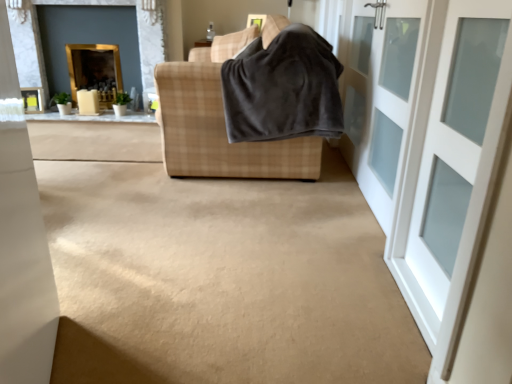
The image size is (512, 384). Describe the element at coordinates (95, 70) in the screenshot. I see `gold-framed mirror at upper left, the 2th fireplace when ordered from right to left` at that location.

Measure the distance between gold-framed mirror at upper left, the 2th fireplace when ordered from right to left, and camera.

gold-framed mirror at upper left, the 2th fireplace when ordered from right to left, is 4.09 meters away from camera.

In order to click on white glass door at right, acting as the second door starting from the back in this screenshot , I will do `click(460, 194)`.

What do you see at coordinates (136, 29) in the screenshot? The height and width of the screenshot is (384, 512). I see `gold-framed mirror at upper left, which is the first fireplace in right-to-left order` at bounding box center [136, 29].

Locate an element on the screen. Image resolution: width=512 pixels, height=384 pixels. gold-framed mirror at upper left, the 1th fireplace viewed from the left is located at coordinates (95, 70).

Which of these two, dark gray fleece blanket at center or plaid fabric sofa at center, is thinner?

Thinner between the two is dark gray fleece blanket at center.

Where is `furniture behind the dark gray fleece blanket at center`? furniture behind the dark gray fleece blanket at center is located at coordinates click(220, 124).

Considering the sizes of objects dark gray fleece blanket at center and plaid fabric sofa at center in the image provided, who is shorter, dark gray fleece blanket at center or plaid fabric sofa at center?

dark gray fleece blanket at center.

Based on the photo, considering the sizes of objects dark gray fleece blanket at center and plaid fabric sofa at center in the image provided, who is bigger, dark gray fleece blanket at center or plaid fabric sofa at center?

With larger size is plaid fabric sofa at center.

Which is more to the left, plaid fabric sofa at center or white glass door at right, arranged as the 1th door when viewed from the front?

plaid fabric sofa at center is more to the left.

How different are the orientations of plaid fabric sofa at center and white glass door at right, arranged as the 1th door when viewed from the front, in degrees?

0.00281 degrees separate the facing orientations of plaid fabric sofa at center and white glass door at right, arranged as the 1th door when viewed from the front.

Does point (213, 133) come behind point (437, 0)?

Yes, point (213, 133) is farther from viewer.

Could you tell me if plaid fabric sofa at center is turned towards white glass door at right, arranged as the 1th door when viewed from the front?

No, plaid fabric sofa at center is not turned towards white glass door at right, arranged as the 1th door when viewed from the front.

Looking at this image, is plaid fabric sofa at center positioned in front of gold-framed mirror at upper left, which is the first fireplace in right-to-left order?

Yes, it is.

In the scene shown: Does plaid fabric sofa at center appear on the right side of gold-framed mirror at upper left, arranged as the 2th fireplace when viewed from the left?

Yes, plaid fabric sofa at center is to the right of gold-framed mirror at upper left, arranged as the 2th fireplace when viewed from the left.

Considering the sizes of objects plaid fabric sofa at center and gold-framed mirror at upper left, arranged as the 2th fireplace when viewed from the left, in the image provided, who is wider, plaid fabric sofa at center or gold-framed mirror at upper left, arranged as the 2th fireplace when viewed from the left,?

plaid fabric sofa at center is wider.

Does plaid fabric sofa at center touch gold-framed mirror at upper left, which is the first fireplace in right-to-left order?

No, plaid fabric sofa at center is not next to gold-framed mirror at upper left, which is the first fireplace in right-to-left order.

Which of these two, dark gray fleece blanket at center or white glass door at right, which appears as the second door when viewed from the front, stands shorter?

dark gray fleece blanket at center.

Between dark gray fleece blanket at center and white glass door at right, marked as the 1th door in a back-to-front arrangement, which one has larger size?

With larger size is dark gray fleece blanket at center.

From the picture: Could you tell me if dark gray fleece blanket at center is turned towards white glass door at right, marked as the 1th door in a back-to-front arrangement?

No, dark gray fleece blanket at center is not turned towards white glass door at right, marked as the 1th door in a back-to-front arrangement.

Based on the photo, is dark gray fleece blanket at center at the left side of white glass door at right, which appears as the second door when viewed from the front?

Yes, dark gray fleece blanket at center is to the left of white glass door at right, which appears as the second door when viewed from the front.

From a real-world perspective, is white glass door at right, which appears as the second door when viewed from the front, over gold-framed mirror at upper left, the 1th fireplace viewed from the left?

Correct, in the physical world, white glass door at right, which appears as the second door when viewed from the front, is higher than gold-framed mirror at upper left, the 1th fireplace viewed from the left.

Does point (361, 40) lie behind point (111, 63)?

That is False.

How many degrees apart are the facing directions of white glass door at right, which appears as the second door when viewed from the front, and gold-framed mirror at upper left, the 2th fireplace when ordered from right to left?

There is a 90.2-degree angle between the facing directions of white glass door at right, which appears as the second door when viewed from the front, and gold-framed mirror at upper left, the 2th fireplace when ordered from right to left.

Could you tell me if gold-framed mirror at upper left, arranged as the 2th fireplace when viewed from the left, is facing plaid fabric sofa at center?

No, gold-framed mirror at upper left, arranged as the 2th fireplace when viewed from the left, is not facing towards plaid fabric sofa at center.

Based on the photo, considering the sizes of objects gold-framed mirror at upper left, which is the first fireplace in right-to-left order, and plaid fabric sofa at center in the image provided, who is taller, gold-framed mirror at upper left, which is the first fireplace in right-to-left order, or plaid fabric sofa at center?

gold-framed mirror at upper left, which is the first fireplace in right-to-left order.

From the image's perspective, which is above, gold-framed mirror at upper left, arranged as the 2th fireplace when viewed from the left, or plaid fabric sofa at center?

From the image's view, gold-framed mirror at upper left, arranged as the 2th fireplace when viewed from the left, is above.

Do you think gold-framed mirror at upper left, which is the first fireplace in right-to-left order, is within plaid fabric sofa at center, or outside of it?

The correct answer is: outside.

From the image's perspective, which one is positioned lower, dark gray fleece blanket at center or gold-framed mirror at upper left, arranged as the 2th fireplace when viewed from the left?

From the image's view, dark gray fleece blanket at center is below.

The height and width of the screenshot is (384, 512). I want to click on blanket located above the gold-framed mirror at upper left, which is the first fireplace in right-to-left order (from a real-world perspective), so [x=283, y=88].

From a real-world perspective, which is physically below, dark gray fleece blanket at center or gold-framed mirror at upper left, which is the first fireplace in right-to-left order?

In real-world perspective, gold-framed mirror at upper left, which is the first fireplace in right-to-left order, is lower.

How far apart are dark gray fleece blanket at center and gold-framed mirror at upper left, which is the first fireplace in right-to-left order?

2.09 meters.

Locate an element on the screen. blanket to the right of plaid fabric sofa at center is located at coordinates (283, 88).

This screenshot has width=512, height=384. Find the location of `furniture above the white glass door at right, acting as the second door starting from the back (from a real-world perspective)`. furniture above the white glass door at right, acting as the second door starting from the back (from a real-world perspective) is located at coordinates [x=220, y=124].

Looking at the image, which one is located closer to white glass door at right, arranged as the 1th door when viewed from the front, gold-framed mirror at upper left, the 1th fireplace viewed from the left, or white glass door at right, which appears as the second door when viewed from the front?

Based on the image, white glass door at right, which appears as the second door when viewed from the front, appears to be nearer to white glass door at right, arranged as the 1th door when viewed from the front.

Based on their spatial positions, is dark gray fleece blanket at center or white glass door at right, marked as the 1th door in a back-to-front arrangement, further from gold-framed mirror at upper left, which is the first fireplace in right-to-left order?

white glass door at right, marked as the 1th door in a back-to-front arrangement, is positioned further to the anchor gold-framed mirror at upper left, which is the first fireplace in right-to-left order.

Which object lies nearer to the anchor point dark gray fleece blanket at center, gold-framed mirror at upper left, arranged as the 2th fireplace when viewed from the left, or white glass door at right, arranged as the 1th door when viewed from the front?

The object closer to dark gray fleece blanket at center is white glass door at right, arranged as the 1th door when viewed from the front.

When comparing their distances from white glass door at right, arranged as the 1th door when viewed from the front, does gold-framed mirror at upper left, which is the first fireplace in right-to-left order, or white glass door at right, marked as the 1th door in a back-to-front arrangement, seem further?

The object further to white glass door at right, arranged as the 1th door when viewed from the front, is gold-framed mirror at upper left, which is the first fireplace in right-to-left order.

Considering their positions, is white glass door at right, acting as the second door starting from the back, positioned closer to gold-framed mirror at upper left, which is the first fireplace in right-to-left order, than plaid fabric sofa at center?

plaid fabric sofa at center is closer to gold-framed mirror at upper left, which is the first fireplace in right-to-left order.

Looking at the image, which one is located closer to white glass door at right, which appears as the second door when viewed from the front, plaid fabric sofa at center or white glass door at right, acting as the second door starting from the back?

Answer: white glass door at right, acting as the second door starting from the back, lies closer to white glass door at right, which appears as the second door when viewed from the front, than the other object.

From the image, which object appears to be farther from plaid fabric sofa at center, gold-framed mirror at upper left, which is the first fireplace in right-to-left order, or white glass door at right, marked as the 1th door in a back-to-front arrangement?

gold-framed mirror at upper left, which is the first fireplace in right-to-left order, is positioned further to the anchor plaid fabric sofa at center.

Considering their positions, is gold-framed mirror at upper left, the 1th fireplace viewed from the left, positioned closer to gold-framed mirror at upper left, arranged as the 2th fireplace when viewed from the left, than white glass door at right, arranged as the 1th door when viewed from the front?

gold-framed mirror at upper left, the 1th fireplace viewed from the left, lies closer to gold-framed mirror at upper left, arranged as the 2th fireplace when viewed from the left, than the other object.

Identify the location of blanket located between white glass door at right, arranged as the 1th door when viewed from the front, and gold-framed mirror at upper left, arranged as the 2th fireplace when viewed from the left, in the depth direction. (283, 88).

Image resolution: width=512 pixels, height=384 pixels. I want to click on fireplace between white glass door at right, acting as the second door starting from the back, and gold-framed mirror at upper left, the 1th fireplace viewed from the left, from front to back, so (x=136, y=29).

You are a GUI agent. You are given a task and a screenshot of the screen. Output one action in this format:
    pyautogui.click(x=<x>, y=<y>)
    Task: Click on the door between white glass door at right, acting as the second door starting from the back, and plaid fabric sofa at center, along the z-axis
    
    Given the screenshot: What is the action you would take?
    pyautogui.click(x=382, y=97)

Identify the location of furniture located between white glass door at right, arranged as the 1th door when viewed from the front, and gold-framed mirror at upper left, the 2th fireplace when ordered from right to left, in the depth direction. Image resolution: width=512 pixels, height=384 pixels. (220, 124).